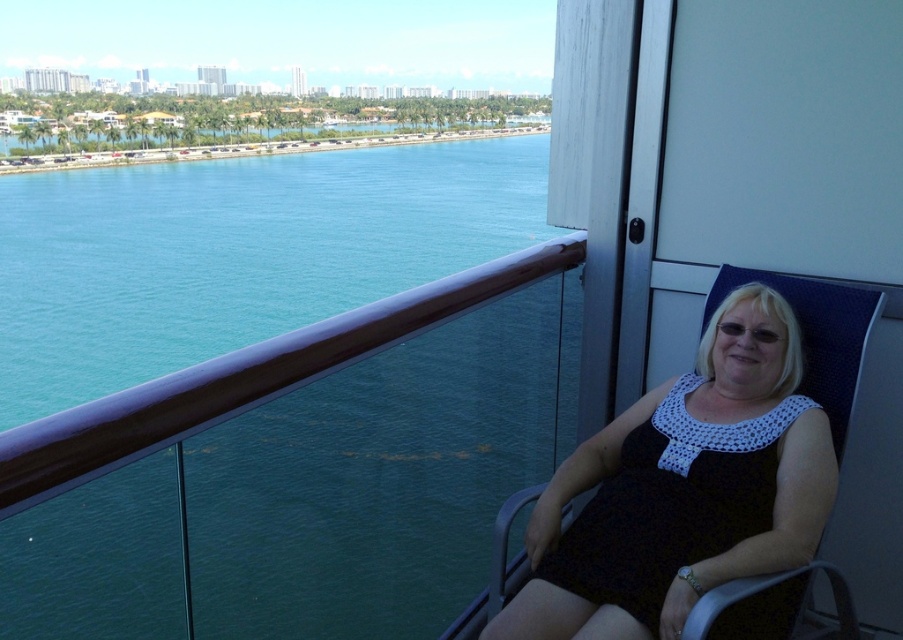
You are a photographer standing on the balcony. You want to capture a photo of the teal glossy water at upper left and the black crochet dress at right. Which object will appear larger in the photo?

The teal glossy water at upper left will appear larger in the photo because it is taller than the black crochet dress at right.

You are standing on the balcony and want to take a photo of the teal glossy water at upper left. Where should you position yourself to capture it in the frame?

To capture the teal glossy water at upper left in your photo, position yourself so that the camera is aimed at the coordinates 0.745 on the x axis and 0.422 on the y axis, as this is where the teal glossy water at upper left is located.

You are standing on the balcony and want to take a photo of the teal glossy water at upper left and the black crochet dress at right. Which object should you focus on first to ensure both are in focus?

You should focus on the teal glossy water at upper left first because it is closer to the viewer than the black crochet dress at right, so adjusting focus from near to far will help both be in focus.